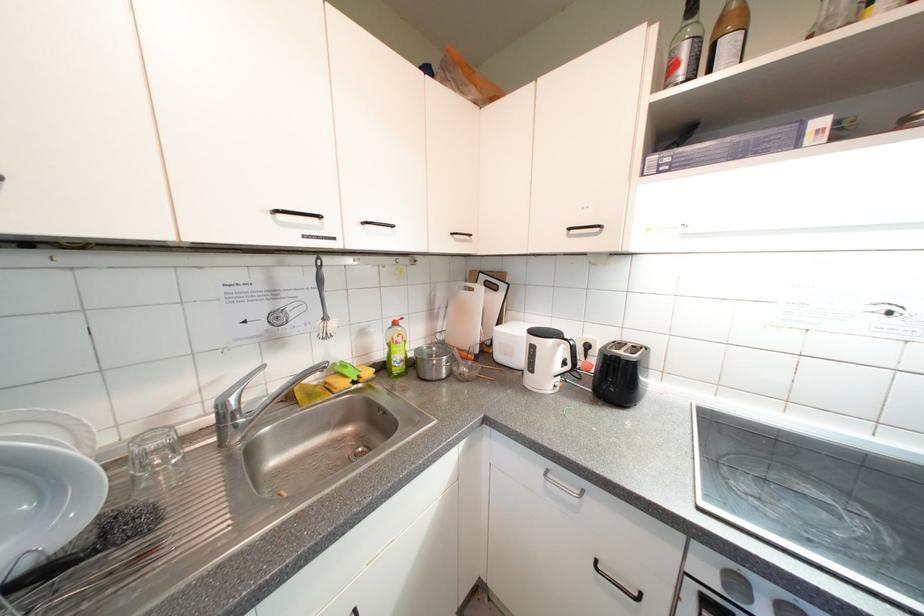
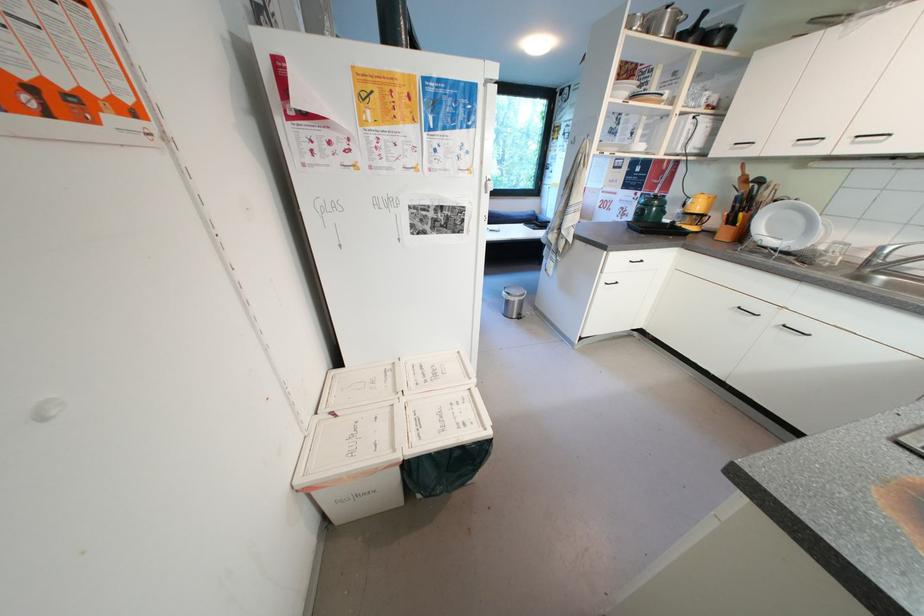
In the second image, find the point that corresponds to pixel 233 419 in the first image.

(883, 257)